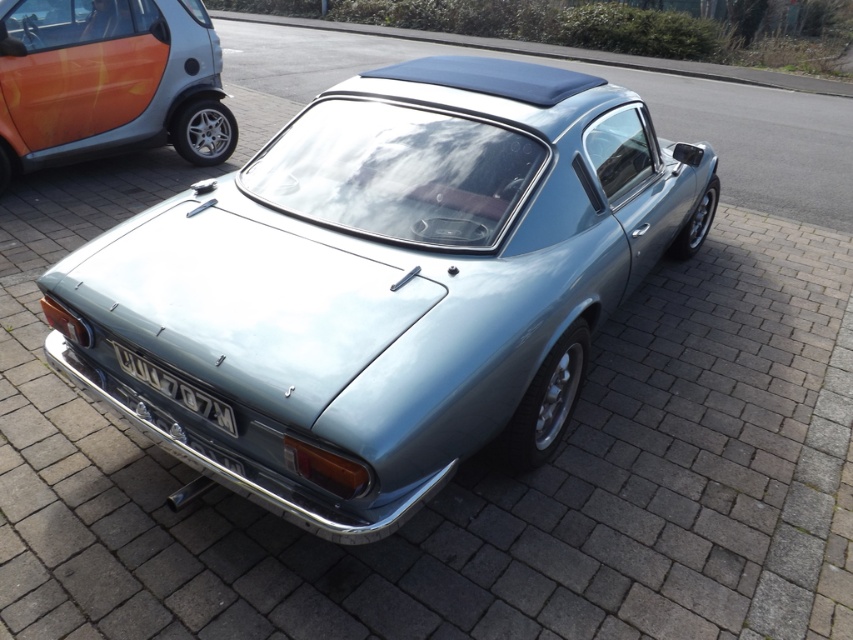
Looking at this image, between orange metallic car at left and gray metallic license plate at lower center, which one appears on the right side from the viewer's perspective?

gray metallic license plate at lower center

Does point (27, 124) come behind point (149, 380)?

Yes, it is behind point (149, 380).

The image size is (853, 640). Identify the location of orange metallic car at left. (108, 83).

Does satin silver car at center appear under orange metallic car at left?

Yes.

Is point (395, 448) farther from viewer compared to point (120, 113)?

No, (395, 448) is in front of (120, 113).

Locate an element on the screen. The height and width of the screenshot is (640, 853). satin silver car at center is located at coordinates (386, 284).

Who is taller, satin silver car at center or gray metallic license plate at lower center?

Standing taller between the two is satin silver car at center.

Between satin silver car at center and gray metallic license plate at lower center, which one is positioned higher?

satin silver car at center

At what (x,y) coordinates should I click in order to perform the action: click on satin silver car at center. Please return your answer as a coordinate pair (x, y). Image resolution: width=853 pixels, height=640 pixels. Looking at the image, I should click on (386, 284).